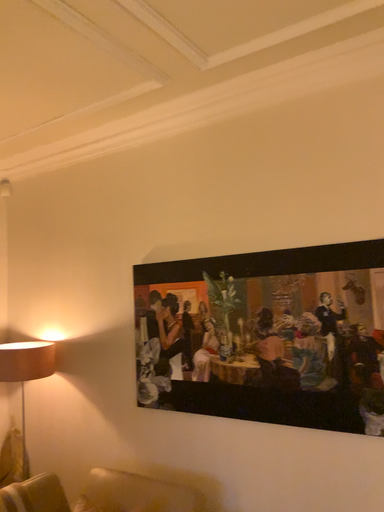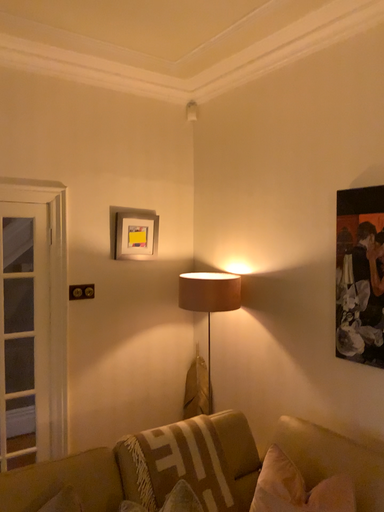
Question: How did the camera likely rotate when shooting the video?

Choices:
 (A) rotated upward
 (B) rotated downward

Answer: (B)